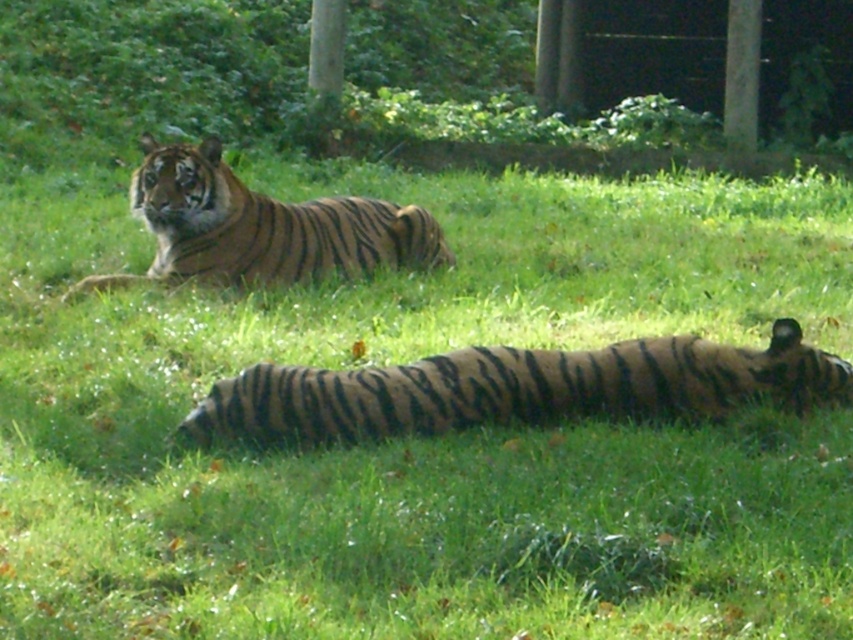
Question: Among these points, which one is farthest from the camera?

Choices:
 (A) (373, 260)
 (B) (248, 412)

Answer: (A)

Question: Which point appears closest to the camera in this image?

Choices:
 (A) pos(436,259)
 (B) pos(341,426)

Answer: (B)

Question: Which point is farther to the camera?

Choices:
 (A) (164, 216)
 (B) (827, 376)

Answer: (A)

Question: Does striped fur tiger at lower center have a smaller size compared to orange-brown striped tiger at upper center?

Choices:
 (A) yes
 (B) no

Answer: (A)

Question: Does striped fur tiger at lower center have a smaller size compared to orange-brown striped tiger at upper center?

Choices:
 (A) no
 (B) yes

Answer: (B)

Question: Can you confirm if striped fur tiger at lower center is wider than orange-brown striped tiger at upper center?

Choices:
 (A) yes
 (B) no

Answer: (A)